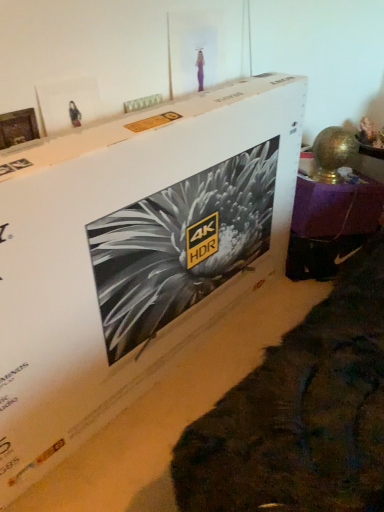
This screenshot has width=384, height=512. I want to click on free spot above white cardboard box at center (from a real-world perspective), so click(x=121, y=125).